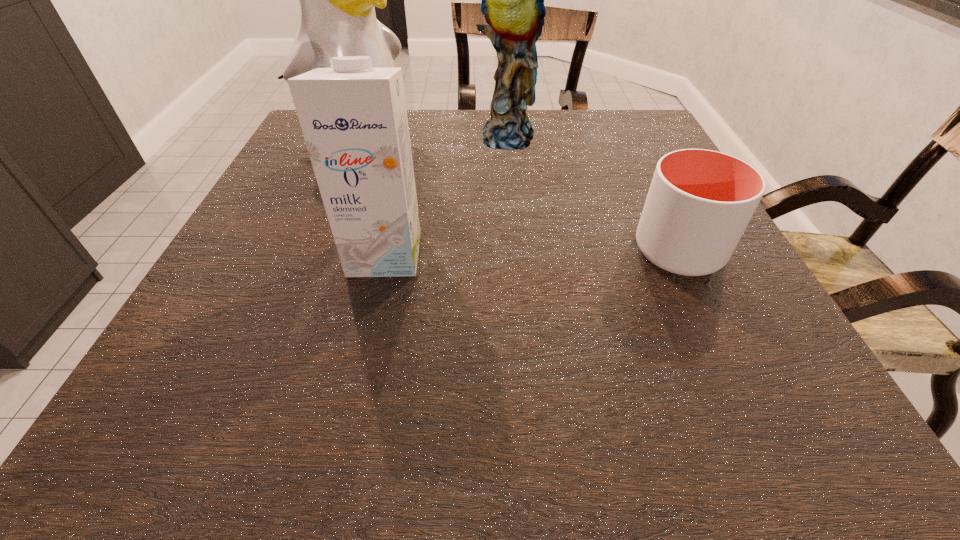
I want to click on vacant area that lies between the carton and the parrot, so click(445, 195).

The height and width of the screenshot is (540, 960). In order to click on empty space that is in between the shortest object and the carton in this screenshot , I will do `click(532, 252)`.

This screenshot has height=540, width=960. Find the location of `vacant space that's between the second object from right to left and the gull`. vacant space that's between the second object from right to left and the gull is located at coordinates (430, 141).

Find the location of a particular element. object that is the third closest one to the parrot is located at coordinates (353, 117).

Identify which object is the third closest to the third tallest object. Please provide its 2D coordinates. Your answer should be formatted as a tuple, i.e. [(x, y)], where the tuple contains the x and y coordinates of a point satisfying the conditions above.

[(699, 203)]

The width and height of the screenshot is (960, 540). I want to click on free location that satisfies the following two spatial constraints: 1. on the front side of the third tallest object; 2. on the left side of the gull, so click(x=310, y=254).

Where is `vacant position in the image that satisfies the following two spatial constraints: 1. on the front side of the shortest object; 2. on the right side of the gull`? The height and width of the screenshot is (540, 960). vacant position in the image that satisfies the following two spatial constraints: 1. on the front side of the shortest object; 2. on the right side of the gull is located at coordinates (312, 251).

Where is `free region that satisfies the following two spatial constraints: 1. on the back side of the shortest object; 2. on the left side of the carton`? This screenshot has width=960, height=540. free region that satisfies the following two spatial constraints: 1. on the back side of the shortest object; 2. on the left side of the carton is located at coordinates (386, 251).

I want to click on vacant point that satisfies the following two spatial constraints: 1. on the back side of the carton; 2. on the left side of the third object from left to right, so click(x=412, y=137).